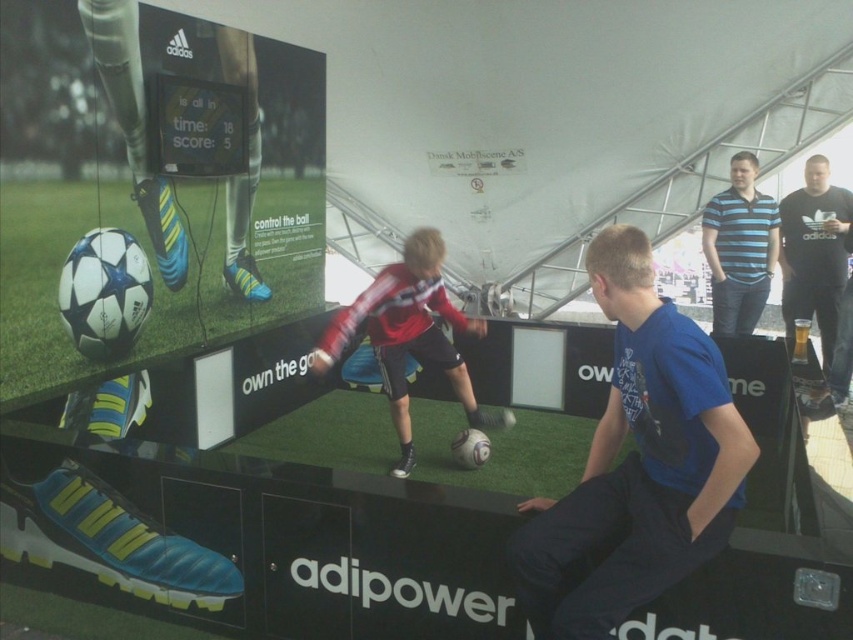
Between blue cotton shirt at center and black cotton shirt at upper right, which one appears on the left side from the viewer's perspective?

blue cotton shirt at center

Who is taller, blue cotton shirt at center or black cotton shirt at upper right?

black cotton shirt at upper right is taller.

Measure the distance between point (x=596, y=502) and camera.

Point (x=596, y=502) is 7.10 feet away from camera.

Where is `blue cotton shirt at center`? This screenshot has width=853, height=640. blue cotton shirt at center is located at coordinates (637, 461).

Is blue cotton shirt at center positioned behind blue striped polo shirt at upper right?

No.

Can you confirm if blue cotton shirt at center is taller than blue striped polo shirt at upper right?

In fact, blue cotton shirt at center may be shorter than blue striped polo shirt at upper right.

Image resolution: width=853 pixels, height=640 pixels. I want to click on blue cotton shirt at center, so click(637, 461).

The height and width of the screenshot is (640, 853). What are the coordinates of `blue cotton shirt at center` in the screenshot? It's located at (637, 461).

Is red striped shirt at center positioned behind blue striped polo shirt at upper right?

No, red striped shirt at center is closer to the viewer.

Does red striped shirt at center have a lesser height compared to blue striped polo shirt at upper right?

Yes.

The image size is (853, 640). What do you see at coordinates (409, 336) in the screenshot?
I see `red striped shirt at center` at bounding box center [409, 336].

Identify the location of red striped shirt at center. This screenshot has width=853, height=640. (409, 336).